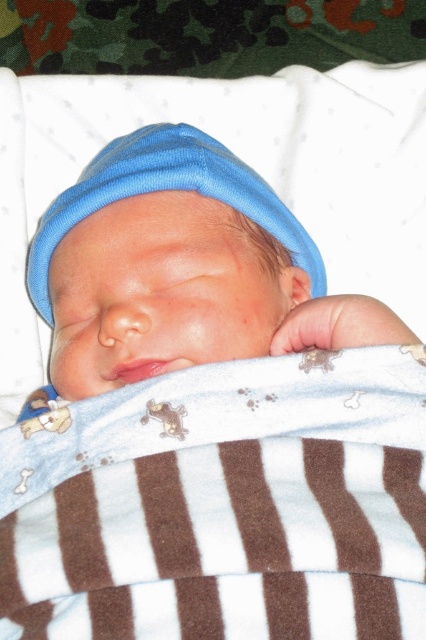
Describe the element at coordinates (224, 504) in the screenshot. I see `brown striped fabric at center` at that location.

Is brown striped fabric at center further to camera compared to matte blue knit hat at center?

No, it is not.

Where is `brown striped fabric at center`? The image size is (426, 640). brown striped fabric at center is located at coordinates (224, 504).